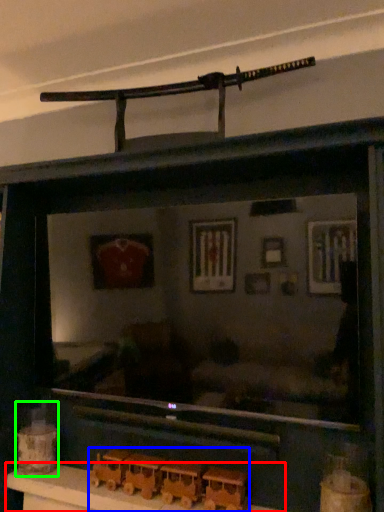
Question: Which object is the closest to the table (highlighted by a red box)? Choose among these: toy (highlighted by a blue box) or toy (highlighted by a green box).

Choices:
 (A) toy
 (B) toy

Answer: (A)